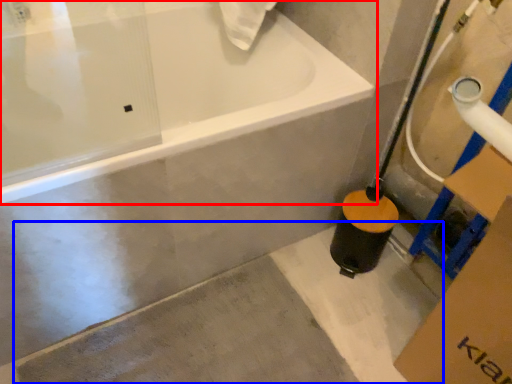
Question: Which object is further to the camera taking this photo, bathtub (highlighted by a red box) or concrete (highlighted by a blue box)?

Choices:
 (A) bathtub
 (B) concrete

Answer: (B)